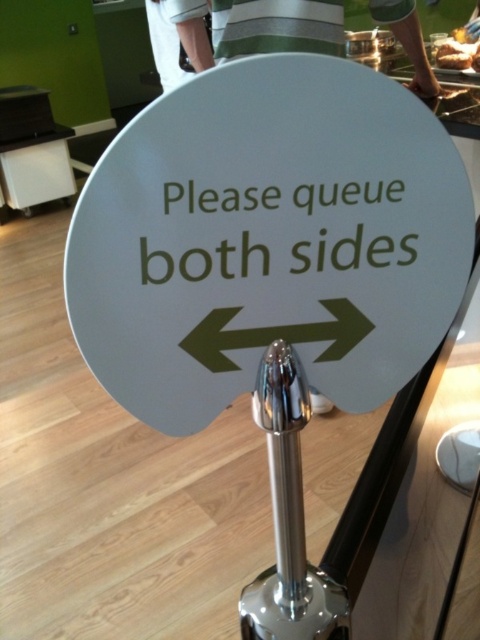
Is white glossy sign at center above polished metal pole at center?

Correct, white glossy sign at center is located above polished metal pole at center.

Identify the location of white glossy sign at center. Image resolution: width=480 pixels, height=640 pixels. (267, 240).

Locate an element on the screen. white glossy sign at center is located at coordinates (267, 240).

Which is above, white glossy sign at center or brown bread at upper right?

brown bread at upper right

Which is more to the left, white glossy sign at center or brown bread at upper right?

white glossy sign at center is more to the left.

The height and width of the screenshot is (640, 480). What do you see at coordinates (267, 240) in the screenshot?
I see `white glossy sign at center` at bounding box center [267, 240].

In order to click on white glossy sign at center in this screenshot , I will do `click(267, 240)`.

Is polished metal pole at center behind brown bread at upper right?

That is False.

Can you confirm if polished metal pole at center is positioned below brown bread at upper right?

Correct, polished metal pole at center is located below brown bread at upper right.

Looking at this image, who is more distant from viewer, [277,513] or [477,42]?

Point [477,42]

Locate an element on the screen. The width and height of the screenshot is (480, 640). polished metal pole at center is located at coordinates (288, 516).